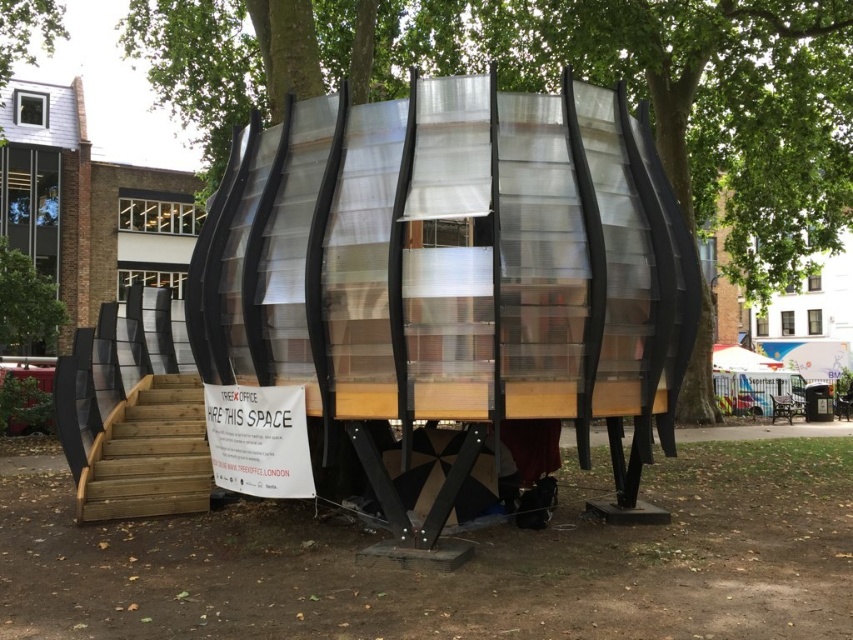
Question: Which of the following is the closest to the observer?

Choices:
 (A) green leafy tree at upper left
 (B) metallic silver hut at upper center

Answer: (A)

Question: Is wooden stairs at lower left bigger than green leafy tree at upper left?

Choices:
 (A) no
 (B) yes

Answer: (A)

Question: Does transparent plastic structure at center appear under green leafy tree at upper left?

Choices:
 (A) yes
 (B) no

Answer: (B)

Question: Is metallic silver hut at upper center bigger than wooden stairs at lower left?

Choices:
 (A) yes
 (B) no

Answer: (A)

Question: Which object appears closest to the camera in this image?

Choices:
 (A) wooden stairs at lower left
 (B) green leafy tree at upper left
 (C) metallic silver hut at upper center
 (D) transparent plastic structure at center

Answer: (D)

Question: Which of the following is the farthest from the observer?

Choices:
 (A) (32, 316)
 (B) (135, 420)

Answer: (A)